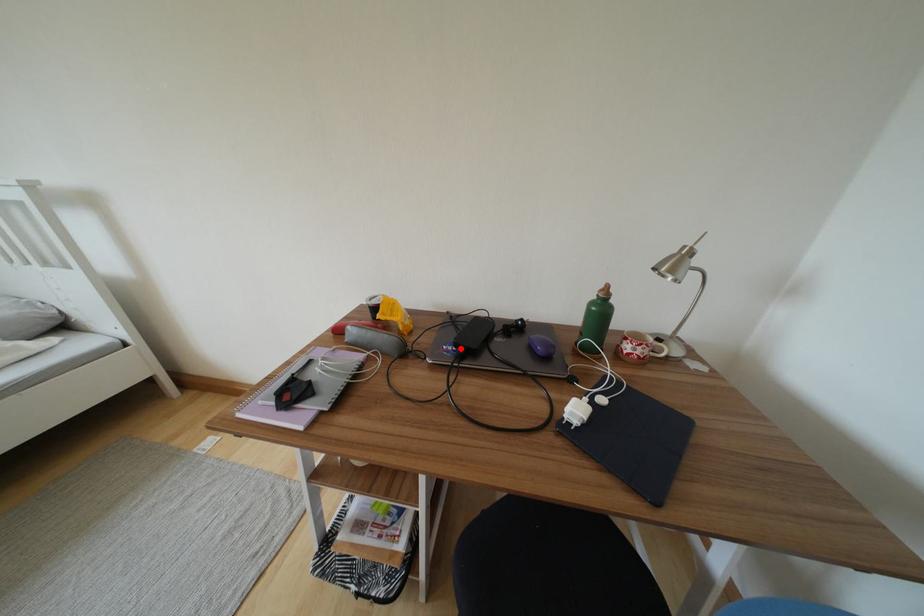
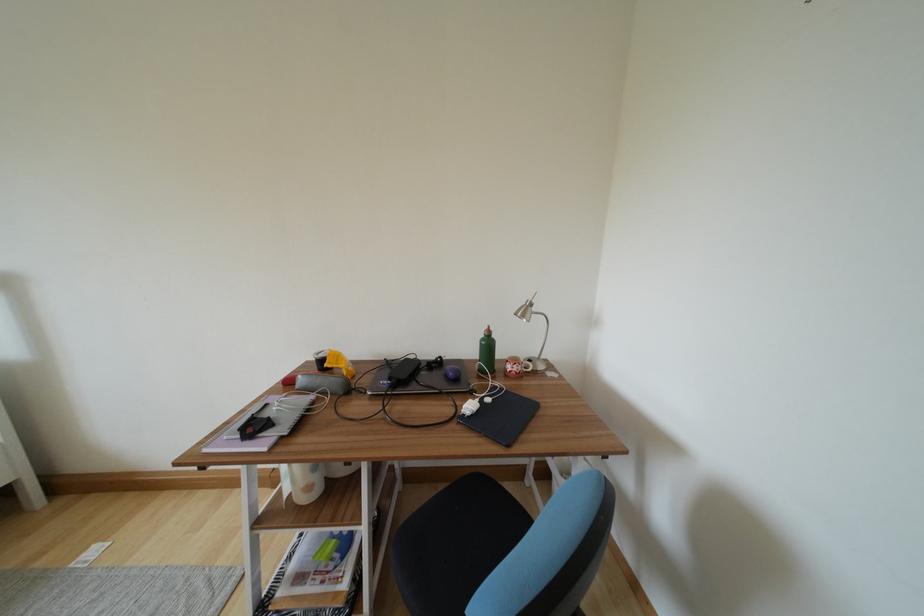
Locate, in the second image, the point that corresponds to the highlighted location in the first image.

(395, 382)